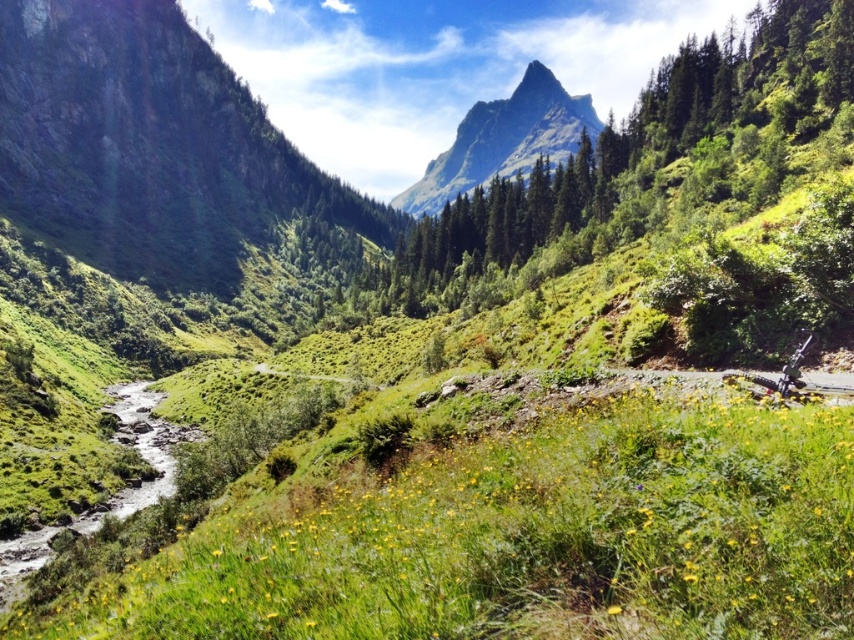
Question: Does green rocky mountain at left appear on the left side of rugged granite peak at upper center?

Choices:
 (A) yes
 (B) no

Answer: (A)

Question: Which of the following is the closest to the observer?

Choices:
 (A) (464, 148)
 (B) (215, 108)

Answer: (B)

Question: Can you confirm if green rocky mountain at left is positioned above rugged granite peak at upper center?

Choices:
 (A) no
 (B) yes

Answer: (A)

Question: Is green rocky mountain at left wider than rugged granite peak at upper center?

Choices:
 (A) no
 (B) yes

Answer: (A)

Question: Which point is farther to the camera?

Choices:
 (A) (562, 100)
 (B) (352, 198)

Answer: (A)